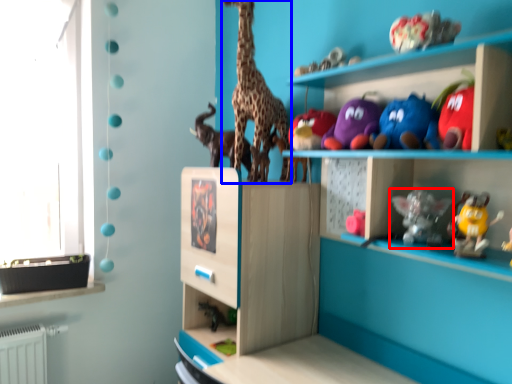
Question: Which object is further to the camera taking this photo, toy (highlighted by a red box) or giraffe (highlighted by a blue box)?

Choices:
 (A) toy
 (B) giraffe

Answer: (B)